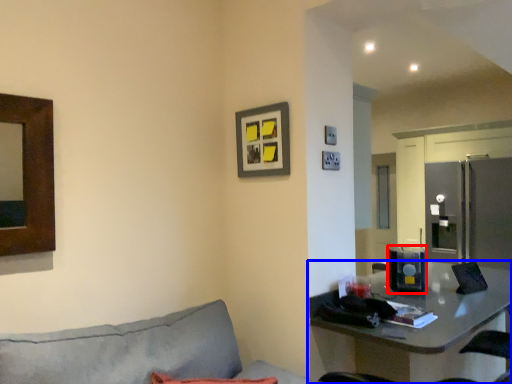
Question: Among these objects, which one is farthest to the camera, appliance (highlighted by a red box) or table (highlighted by a blue box)?

Choices:
 (A) appliance
 (B) table

Answer: (A)